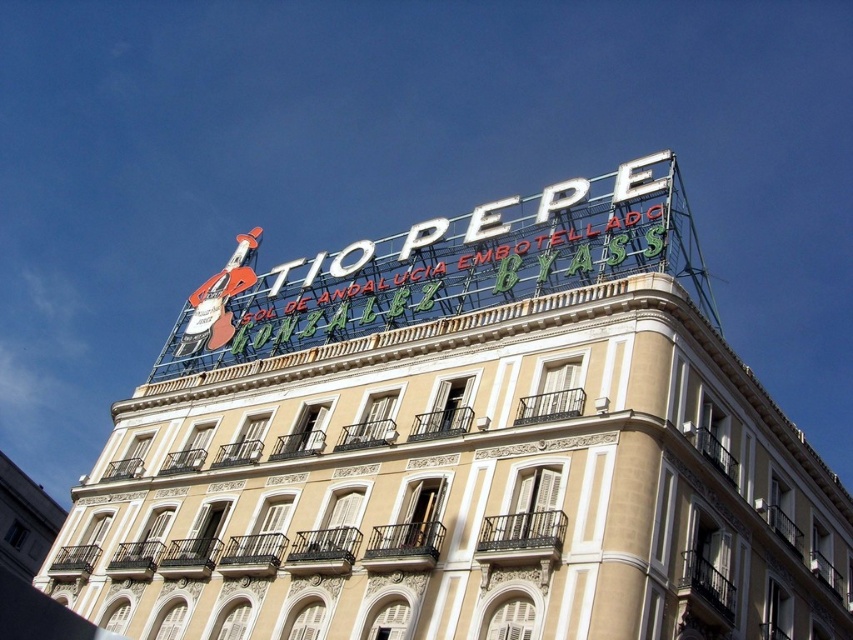
Question: Considering the relative positions of beige stone building at center and white metallic sign at upper center in the image provided, where is beige stone building at center located with respect to white metallic sign at upper center?

Choices:
 (A) right
 (B) left

Answer: (B)

Question: Is the position of beige stone building at center less distant than that of white metallic sign at upper center?

Choices:
 (A) yes
 (B) no

Answer: (A)

Question: Among these points, which one is nearest to the camera?

Choices:
 (A) (566, 248)
 (B) (498, 518)

Answer: (B)

Question: Is beige stone building at center bigger than white metallic sign at upper center?

Choices:
 (A) no
 (B) yes

Answer: (A)

Question: Which point appears farthest from the camera in this image?

Choices:
 (A) tap(239, 346)
 (B) tap(222, 621)

Answer: (A)